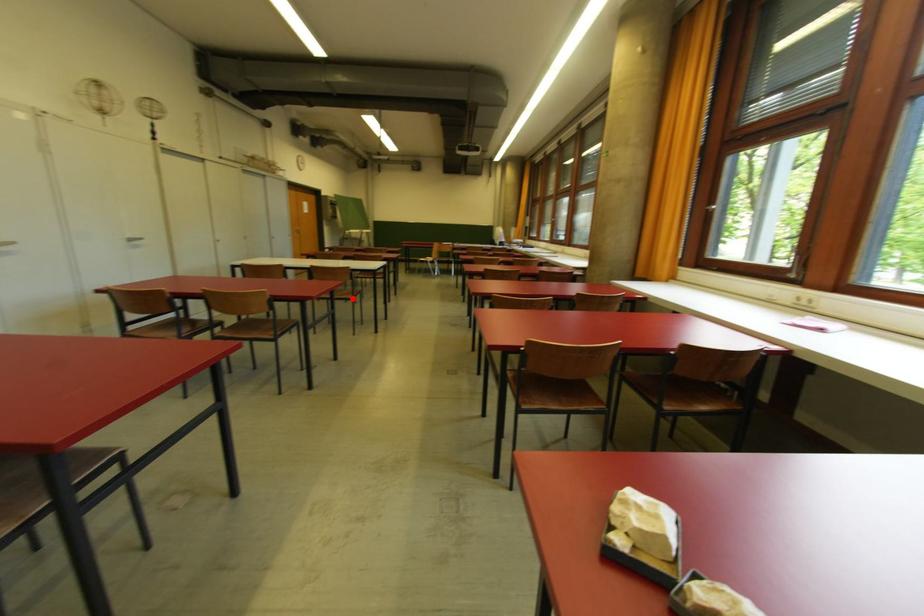
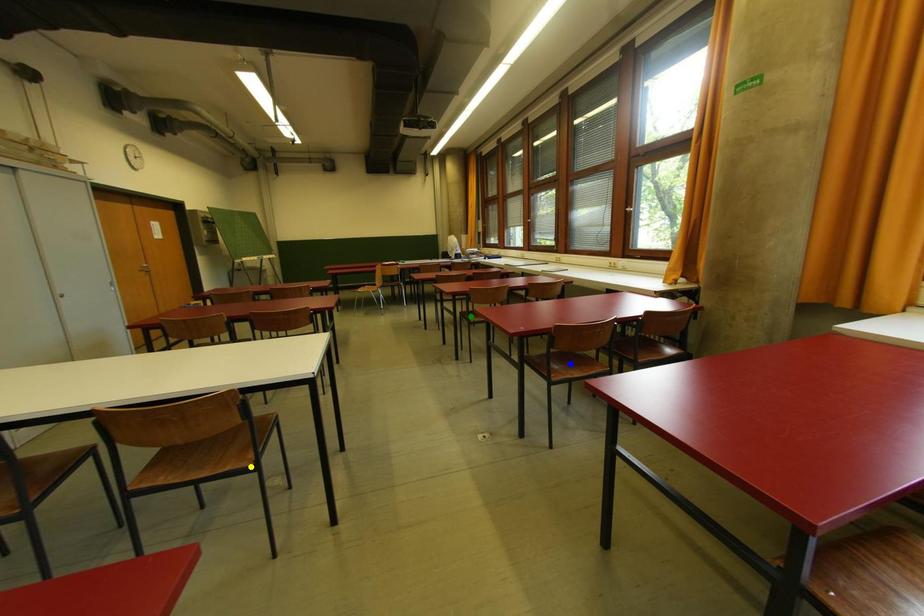
Question: I am providing you with two images of the same scene from different viewpoints. A red point is marked on the first image. You are given multiple points on the second image. Which spot in image 2 lines up with the point in image 1?

Choices:
 (A) blue point
 (B) yellow point
 (C) green point

Answer: (B)